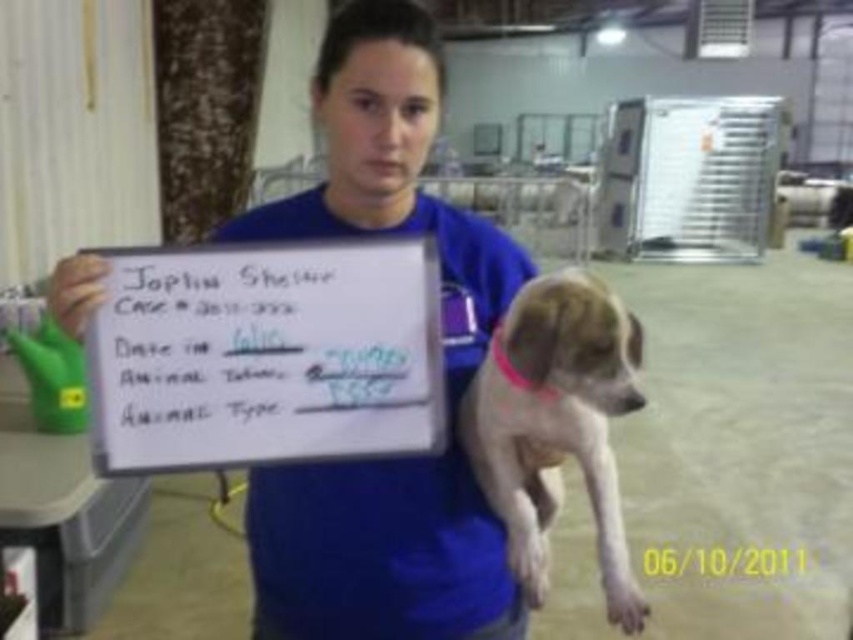
Who is higher up, blue fabric shirt at center or white paper at center?

white paper at center is above.

You are a GUI agent. You are given a task and a screenshot of the screen. Output one action in this format:
    pyautogui.click(x=<x>, y=<y>)
    Task: Click on the blue fabric shirt at center
    This screenshot has height=640, width=853.
    Given the screenshot: What is the action you would take?
    pyautogui.click(x=378, y=552)

Is point (219, 234) closer to viewer compared to point (144, 330)?

No.

Locate an element on the screen. This screenshot has height=640, width=853. blue fabric shirt at center is located at coordinates (378, 552).

Who is taller, blue fabric shirt at center or light brown fur at center?

Standing taller between the two is blue fabric shirt at center.

The image size is (853, 640). Describe the element at coordinates (378, 552) in the screenshot. I see `blue fabric shirt at center` at that location.

Is point (387, 68) more distant than point (637, 324)?

That is True.

At what (x,y) coordinates should I click in order to perform the action: click on blue fabric shirt at center. Please return your answer as a coordinate pair (x, y). This screenshot has width=853, height=640. Looking at the image, I should click on (378, 552).

Who is shorter, white paper at center or light brown fur at center?

With less height is white paper at center.

Based on the photo, can you confirm if white paper at center is positioned to the right of light brown fur at center?

In fact, white paper at center is to the left of light brown fur at center.

This screenshot has width=853, height=640. What do you see at coordinates (265, 355) in the screenshot?
I see `white paper at center` at bounding box center [265, 355].

You are a GUI agent. You are given a task and a screenshot of the screen. Output one action in this format:
    pyautogui.click(x=<x>, y=<y>)
    Task: Click on the white paper at center
    
    Given the screenshot: What is the action you would take?
    pyautogui.click(x=265, y=355)